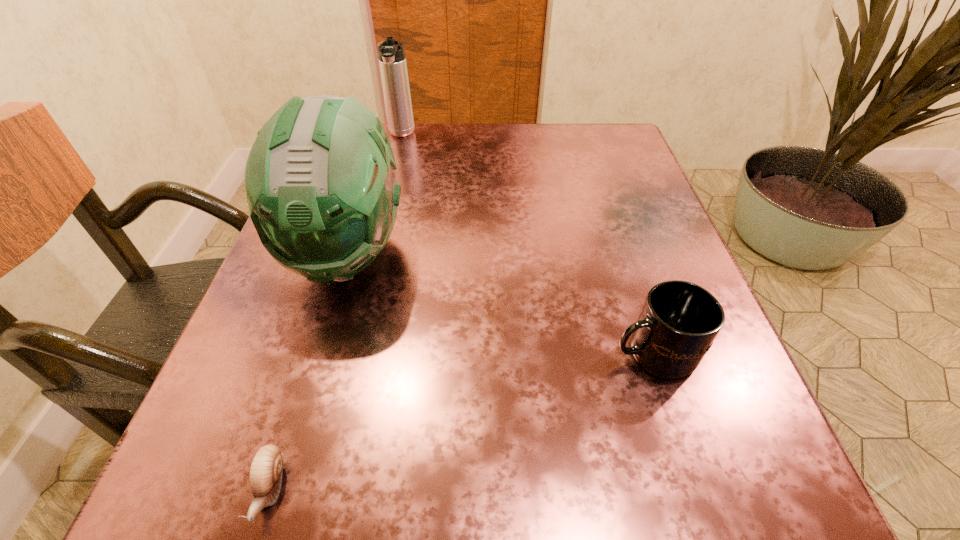
This screenshot has height=540, width=960. Find the location of `vacant space situated 0.090m with the handle on the side of the rightmost object`. vacant space situated 0.090m with the handle on the side of the rightmost object is located at coordinates (546, 353).

Where is `free point located 0.080m with the handle on the side of the rightmost object`? free point located 0.080m with the handle on the side of the rightmost object is located at coordinates (553, 353).

This screenshot has height=540, width=960. In order to click on free space located with the handle on the side of the rightmost object in this screenshot , I will do `click(476, 353)`.

The height and width of the screenshot is (540, 960). Find the location of `object that is at the far edge`. object that is at the far edge is located at coordinates (392, 60).

Where is `object present at the near edge`? The width and height of the screenshot is (960, 540). object present at the near edge is located at coordinates (266, 468).

Where is `football helmet present at the left edge`? The height and width of the screenshot is (540, 960). football helmet present at the left edge is located at coordinates (320, 183).

The image size is (960, 540). I want to click on thermos bottle that is at the left edge, so click(x=392, y=60).

Where is `escargot that is positioned at the left edge`? escargot that is positioned at the left edge is located at coordinates (266, 468).

At what (x,y) coordinates should I click in order to perform the action: click on object that is at the right edge. Please return your answer as a coordinate pair (x, y). The image size is (960, 540). Looking at the image, I should click on (679, 321).

Identify the location of object located at the far left corner. (392, 60).